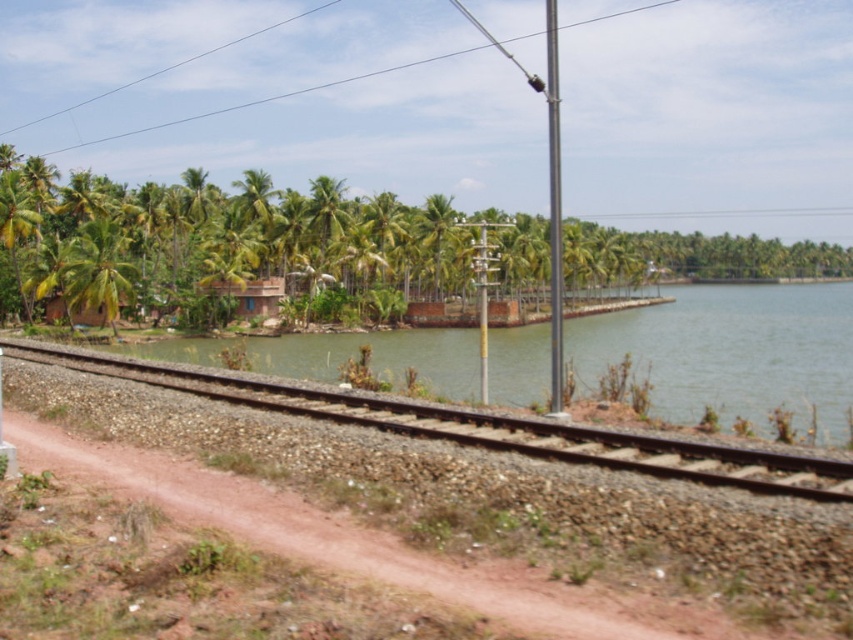
Which is more to the left, silver metallic pole at right or metallic pole at center?

Positioned to the left is metallic pole at center.

Who is higher up, silver metallic pole at right or metallic pole at center?

silver metallic pole at right is higher up.

Does point (558, 204) come closer to viewer compared to point (489, 244)?

Yes, it is in front of point (489, 244).

Where is `silver metallic pole at right`? The width and height of the screenshot is (853, 640). silver metallic pole at right is located at coordinates (554, 209).

Between silver metallic pole at right and green leafy palm tree at center, which one is positioned higher?

Positioned higher is silver metallic pole at right.

Who is positioned more to the right, silver metallic pole at right or green leafy palm tree at center?

From the viewer's perspective, silver metallic pole at right appears more on the right side.

Does point (553, 44) come closer to viewer compared to point (434, 259)?

No, (553, 44) is behind (434, 259).

Locate an element on the screen. The image size is (853, 640). silver metallic pole at right is located at coordinates (554, 209).

Is brown gravel track at lower center positioned before green leafy palm tree at center?

That is True.

Is brown gravel track at lower center taller than green leafy palm tree at center?

No, brown gravel track at lower center is not taller than green leafy palm tree at center.

Find the location of a particular element. Image resolution: width=853 pixels, height=640 pixels. brown gravel track at lower center is located at coordinates (476, 426).